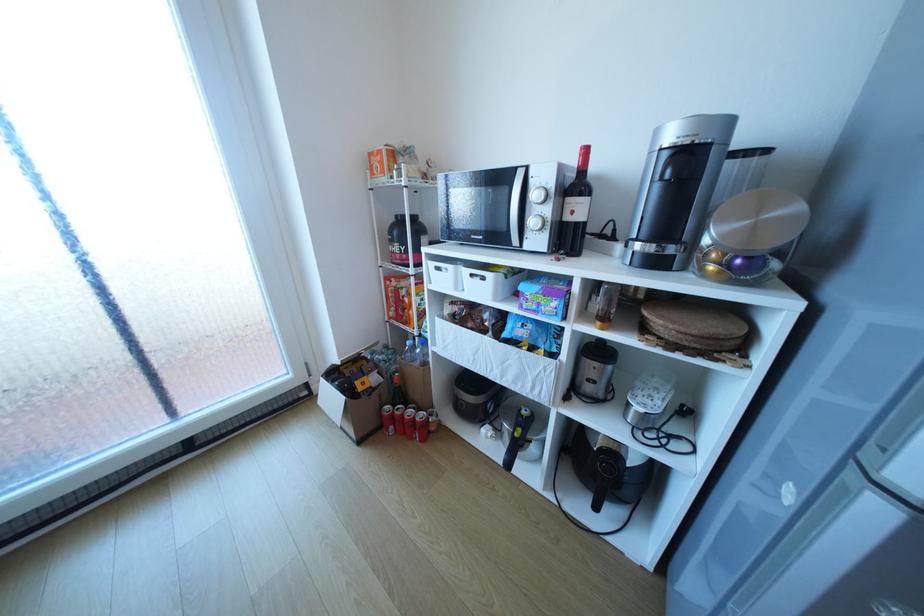
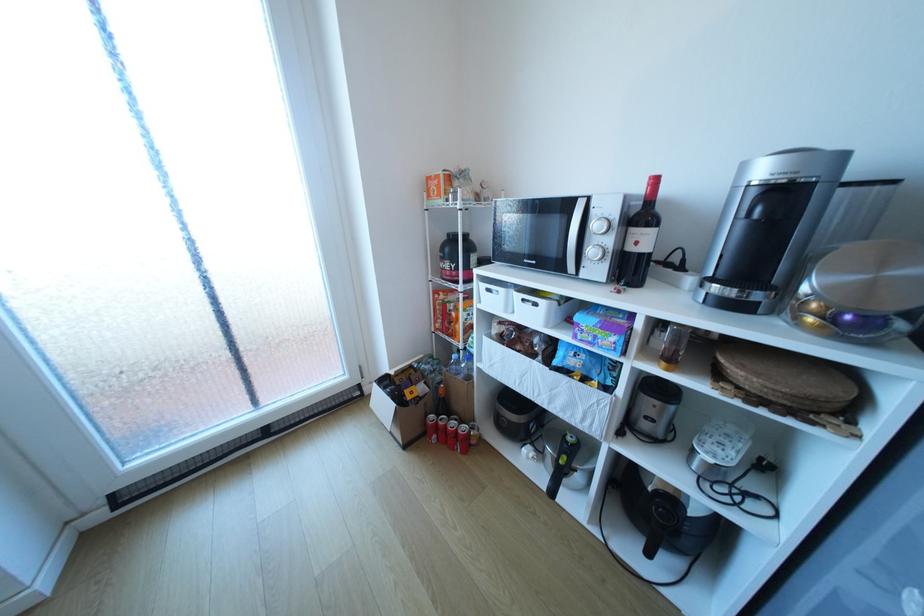
Which direction would the cameraman need to move to produce the second image?

The cameraman moved toward left, backward.